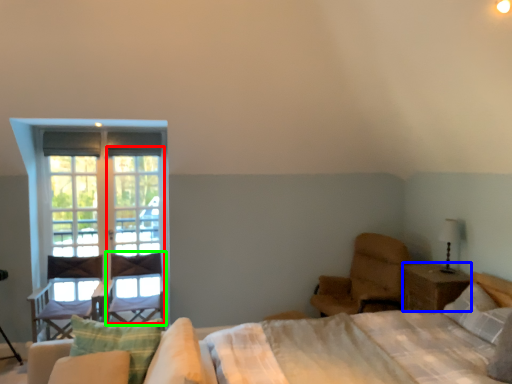
Question: Considering the real-world distances, which object is closest to screen door (highlighted by a red box)? nightstand (highlighted by a blue box) or swivel chair (highlighted by a green box).

Choices:
 (A) nightstand
 (B) swivel chair

Answer: (B)